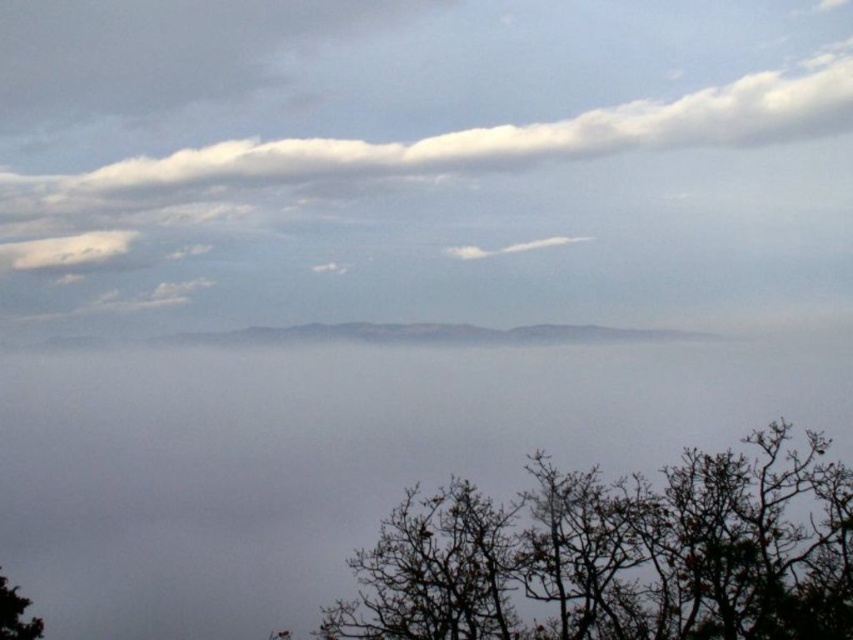
Is green matte tree at lower left thinner than white fluffy cloud at center?

Correct, green matte tree at lower left's width is less than white fluffy cloud at center's.

Can you confirm if green matte tree at lower left is positioned to the right of white fluffy cloud at center?

Incorrect, green matte tree at lower left is not on the right side of white fluffy cloud at center.

You are a GUI agent. You are given a task and a screenshot of the screen. Output one action in this format:
    pyautogui.click(x=<x>, y=<y>)
    Task: Click on the green matte tree at lower left
    This screenshot has width=853, height=640.
    Given the screenshot: What is the action you would take?
    pyautogui.click(x=16, y=612)

Is white fluffy cloud at upper center bigger than green matte tree at lower left?

Yes.

At what (x,y) coordinates should I click in order to perform the action: click on white fluffy cloud at upper center. Please return your answer as a coordinate pair (x, y). This screenshot has width=853, height=640. Looking at the image, I should click on (390, 163).

The width and height of the screenshot is (853, 640). What are the coordinates of `white fluffy cloud at upper center` in the screenshot? It's located at (390, 163).

Between brown leafless branches at lower right and white fluffy cloud at center, which one is positioned lower?

brown leafless branches at lower right is below.

Between brown leafless branches at lower right and white fluffy cloud at center, which one appears on the left side from the viewer's perspective?

From the viewer's perspective, white fluffy cloud at center appears more on the left side.

Locate an element on the screen. brown leafless branches at lower right is located at coordinates (618, 554).